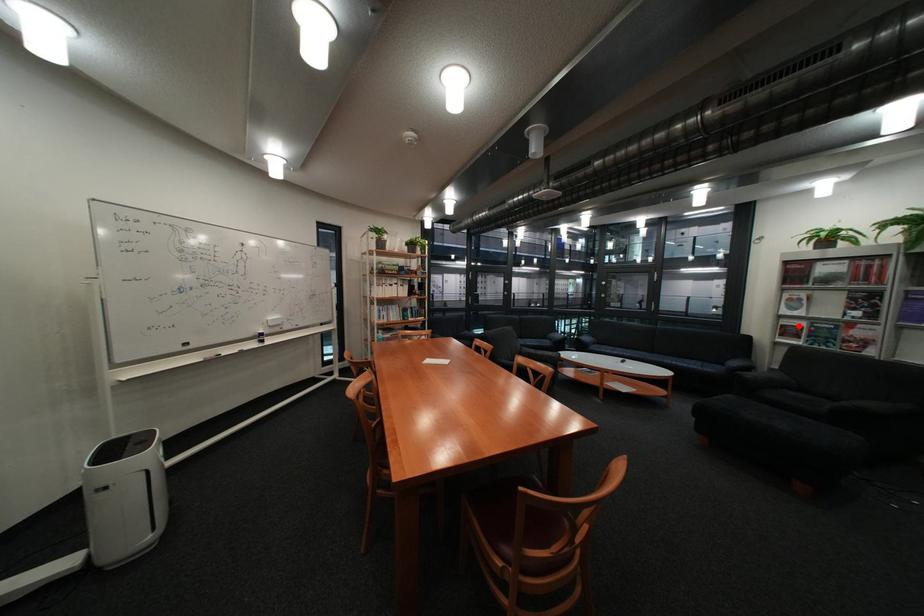
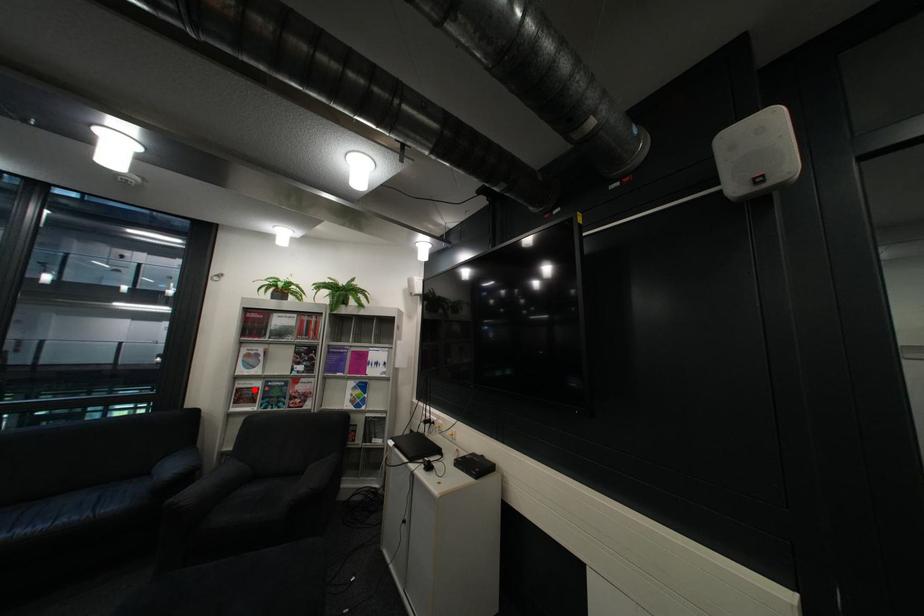
I am providing you with two images of the same scene from different viewpoints. A red point is marked on the first image and another point is marked on the second image. Is the red point in image1 aligned with the point shown in image2?

Yes